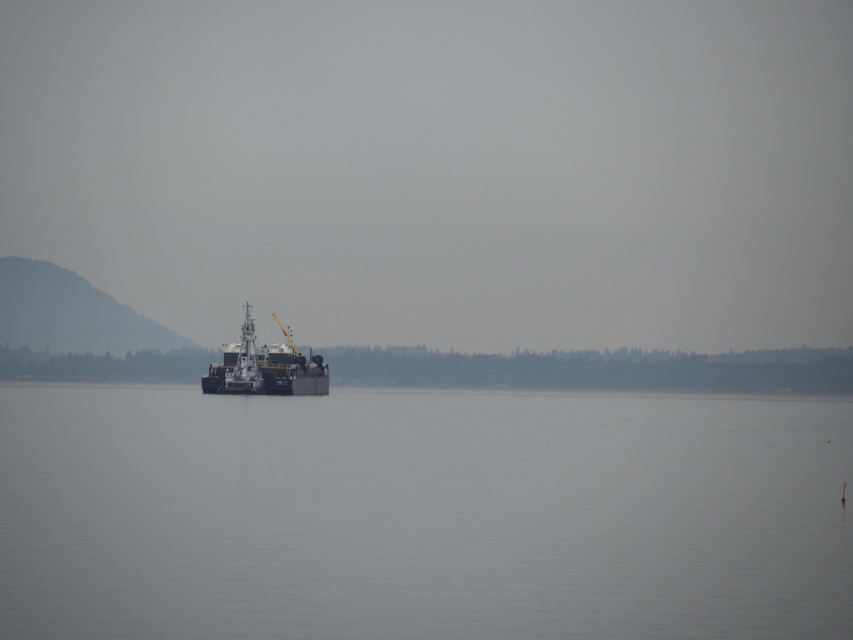
Question: Can you confirm if gray water at center is thinner than metallic gray barge at center?

Choices:
 (A) yes
 (B) no

Answer: (B)

Question: Which point is farther to the camera?

Choices:
 (A) (846, 568)
 (B) (312, 376)

Answer: (B)

Question: Is gray water at center to the right of metallic gray barge at center from the viewer's perspective?

Choices:
 (A) yes
 (B) no

Answer: (A)

Question: Does gray water at center have a smaller size compared to metallic gray barge at center?

Choices:
 (A) yes
 (B) no

Answer: (B)